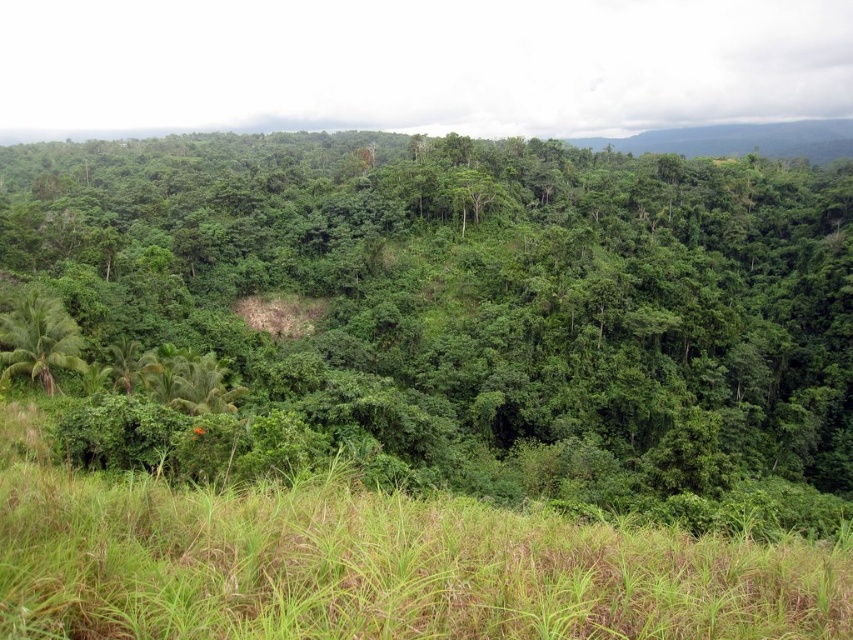
Question: Is green grassy field at lower center positioned at the back of green leafy palm tree at lower left?

Choices:
 (A) yes
 (B) no

Answer: (B)

Question: Estimate the real-world distances between objects in this image. Which object is closer to the green leafy tree at center?

Choices:
 (A) green leafy palm tree at lower left
 (B) green grassy field at lower center

Answer: (A)

Question: Which point appears farthest from the camera in this image?

Choices:
 (A) pyautogui.click(x=51, y=388)
 (B) pyautogui.click(x=363, y=531)

Answer: (A)

Question: Among these points, which one is farthest from the camera?

Choices:
 (A) (364, 506)
 (B) (460, 193)
 (C) (32, 323)

Answer: (B)

Question: Can you confirm if green leafy tree at center is wider than green leafy palm tree at lower left?

Choices:
 (A) no
 (B) yes

Answer: (B)

Question: In this image, where is green grassy field at lower center located relative to green leafy palm tree at lower left?

Choices:
 (A) below
 (B) above

Answer: (A)